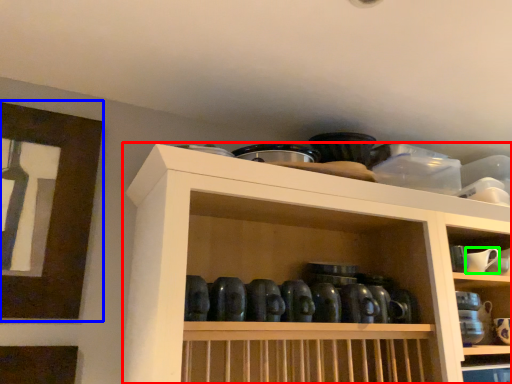
Question: Which object is positioned closest to shelf (highlighted by a red box)? Select from picture frame (highlighted by a blue box) and tableware (highlighted by a green box).

Choices:
 (A) picture frame
 (B) tableware

Answer: (A)